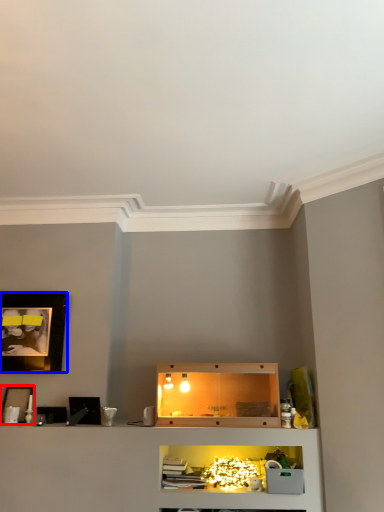
Question: Which of the following is the closest to the observer, picture frame (highlighted by a red box) or picture frame (highlighted by a blue box)?

Choices:
 (A) picture frame
 (B) picture frame

Answer: (A)